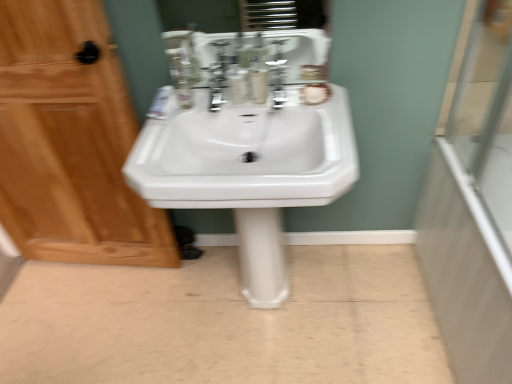
What are the coordinates of `vacant space positioned to the left of translucent plastic mouthwash at center, positioned as the first mouthwash in left-to-right order` in the screenshot? It's located at (201, 102).